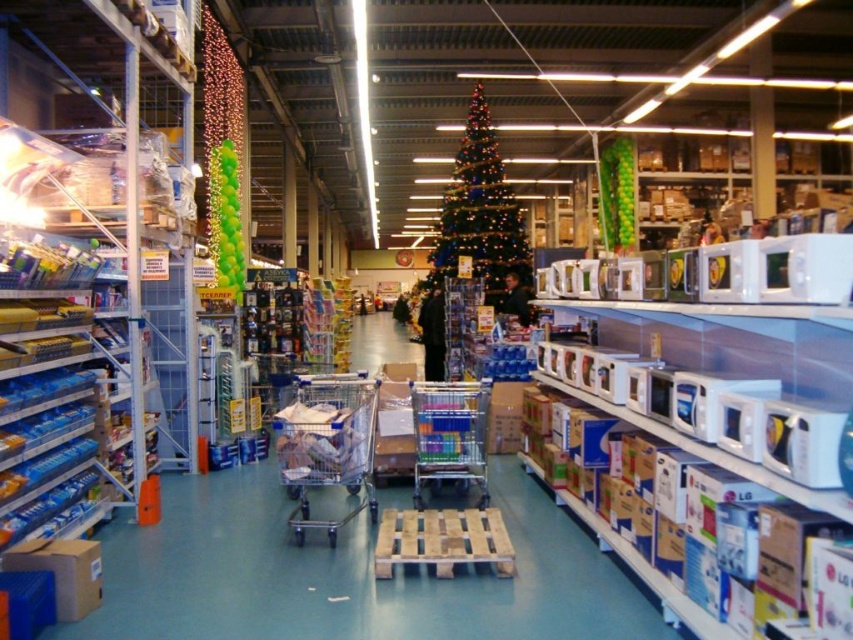
You are a delivery person holding a large package that is 3 feet wide. You need to move from the entrance of the store to the green glittering christmas tree at center. The path is clear except for a narrow aisle that is 3.5 feet wide. Can you pass through the aisle safely with your package?

The path between the green glittering christmas tree at center and the camera is 27.66 feet apart. Since the narrow aisle is 3.5 feet wide and your package is 3 feet wide, you can safely pass through the aisle as the width is sufficient for your package.

You are a delivery person trying to navigate through the center of the store. You need to move a large box that is currently placed between the green glittering christmas tree at center and the chrome metallic shopping cart at center. Based on their sizes, can you estimate if there is enough space to maneuver the box around them?

The green glittering christmas tree at center might be wider than the chrome metallic shopping cart at center, so there may not be enough space to maneuver the large box around them safely. It would be advisable to check the exact dimensions before attempting to move the box.